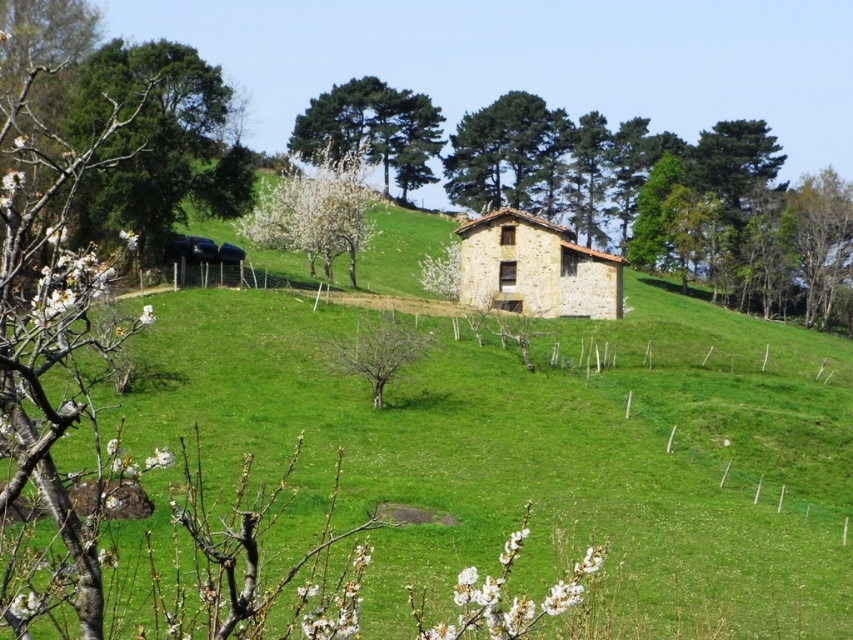
Question: Which point is closer to the camera taking this photo?

Choices:
 (A) (389, 316)
 (B) (366, 92)
 (C) (550, 188)
 (D) (163, 60)

Answer: (A)

Question: Which of the following is the farthest from the observer?

Choices:
 (A) (354, 356)
 (B) (351, 140)
 (C) (166, 179)
 (D) (532, 189)

Answer: (D)

Question: Is green leafy tree at center wider than green leafy trees at upper center?

Choices:
 (A) no
 (B) yes

Answer: (A)

Question: Based on their relative distances, which object is nearer to the green leafy tree at left?

Choices:
 (A) green leafy tree at center
 (B) bare wood tree at center
 (C) green leafy trees at upper center
 (D) white blossoming tree at center

Answer: (D)

Question: Observing the image, what is the correct spatial positioning of green leafy tree at left in reference to green leafy trees at upper center?

Choices:
 (A) above
 (B) below

Answer: (B)

Question: Does green leafy tree at center have a larger size compared to white blossoming tree at center?

Choices:
 (A) yes
 (B) no

Answer: (A)